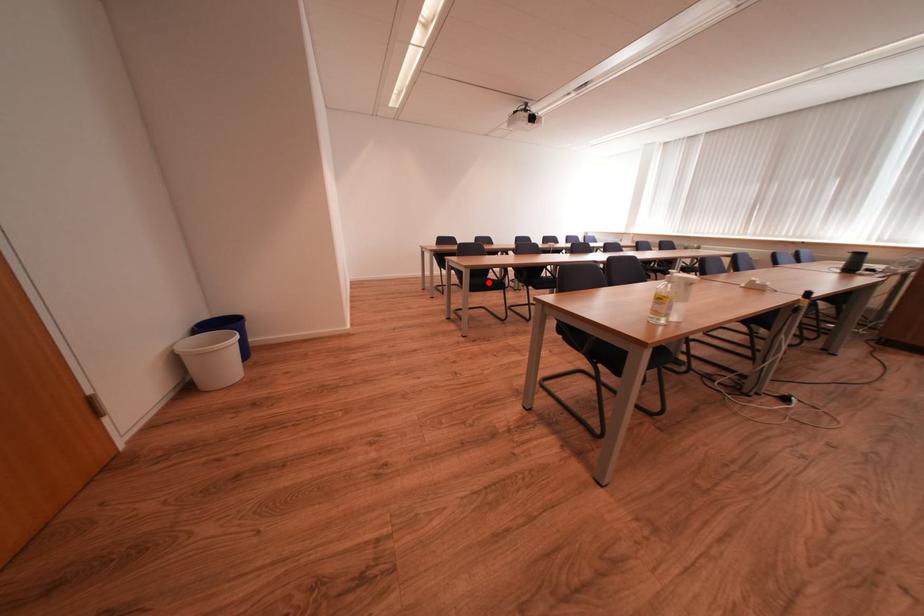
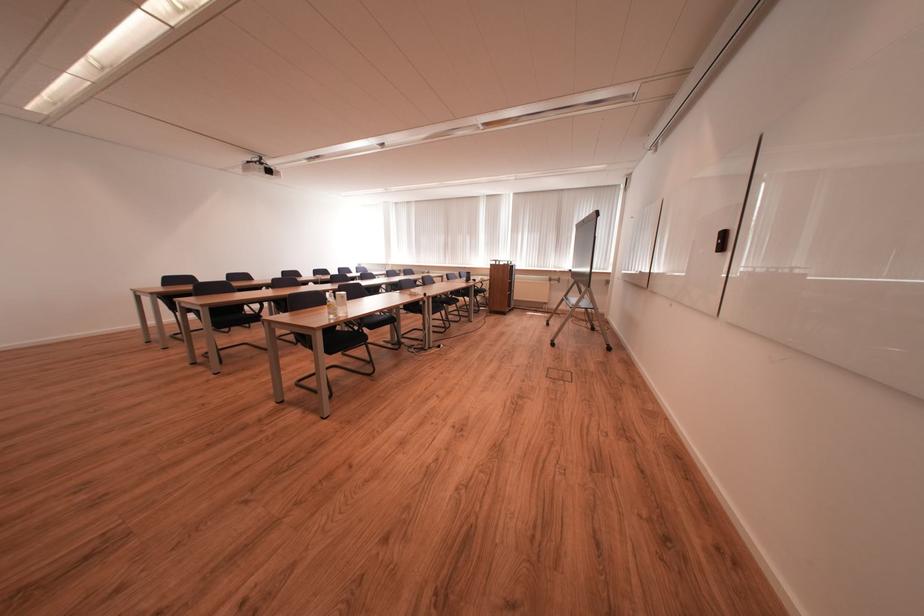
Where in the second image is the point corresponding to the highlighted location from the first image?

(237, 318)